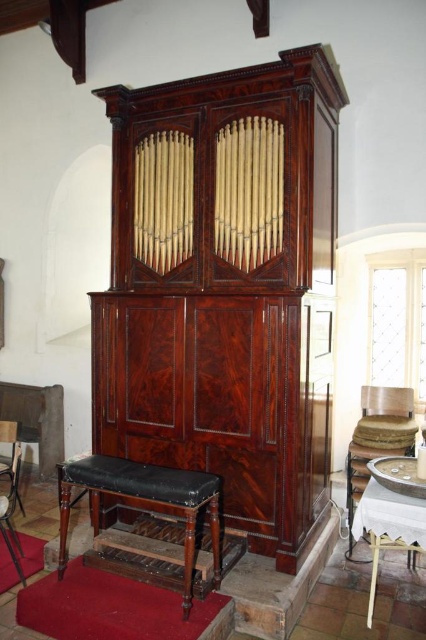
Question: Considering the real-world distances, which object is farthest from the mahogany leather stool at lower left?

Choices:
 (A) mahogany wood pipe organ at center
 (B) smooth black leather bench at lower left

Answer: (A)

Question: Considering the relative positions of mahogany leather stool at lower left and smooth black leather bench at lower left in the image provided, where is mahogany leather stool at lower left located with respect to smooth black leather bench at lower left?

Choices:
 (A) left
 (B) right

Answer: (B)

Question: Which object is farther from the camera taking this photo?

Choices:
 (A) mahogany leather stool at lower left
 (B) smooth black leather bench at lower left

Answer: (B)

Question: Is mahogany wood pipe organ at center thinner than mahogany leather stool at lower left?

Choices:
 (A) no
 (B) yes

Answer: (A)

Question: Which of these objects is positioned farthest from the mahogany leather stool at lower left?

Choices:
 (A) mahogany wood pipe organ at center
 (B) smooth black leather bench at lower left

Answer: (A)

Question: Is mahogany wood pipe organ at center below mahogany leather stool at lower left?

Choices:
 (A) no
 (B) yes

Answer: (A)